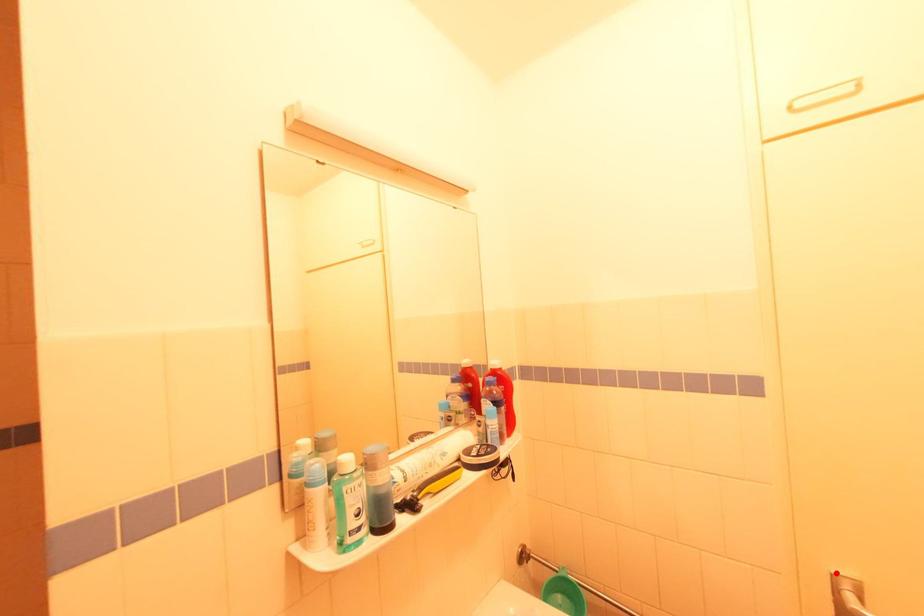
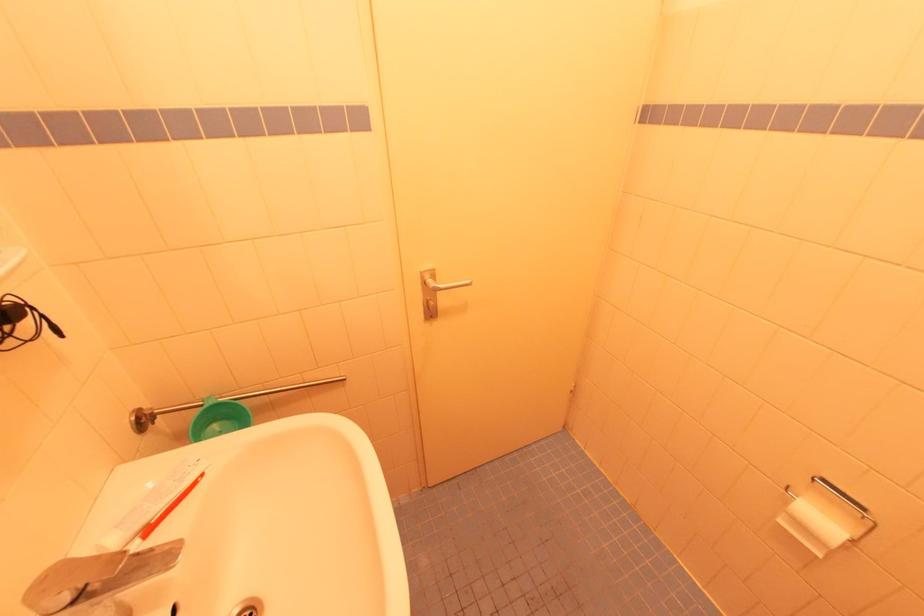
In the second image, find the point that corresponds to the highlighted location in the first image.

(423, 272)